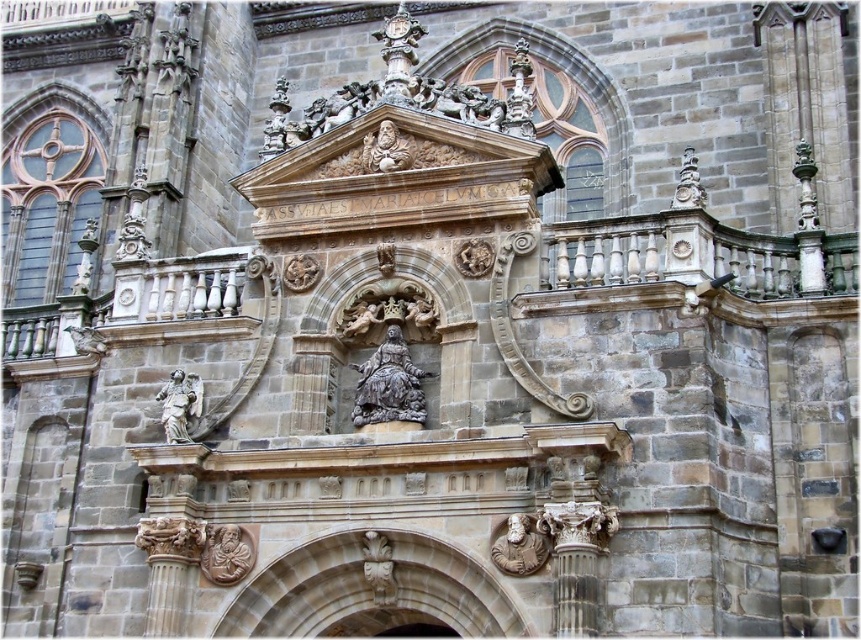
You are an architect analyzing the symmetry of the building. You notice the gray stone statue at center. Where exactly is it placed in terms of coordinates?

The gray stone statue at center is placed at coordinates point (389, 385).

You are an architect examining the facade of this historical building. You need to determine which of the two elements, the gray stone statue at center or the carved stone angel at lower center, is bigger in size. Based on the description, which one is larger?

The gray stone statue at center is larger in size compared to the carved stone angel at lower center.

Consider the image. You are an art conservator examining the facade of this historical building. You notice two angels on the facade. The polished bronze angel at lower left and the carved stone angel at lower center. Which angel is positioned closer to the viewer?

The polished bronze angel at lower left is closer to the viewer because the carved stone angel at lower center is behind it.